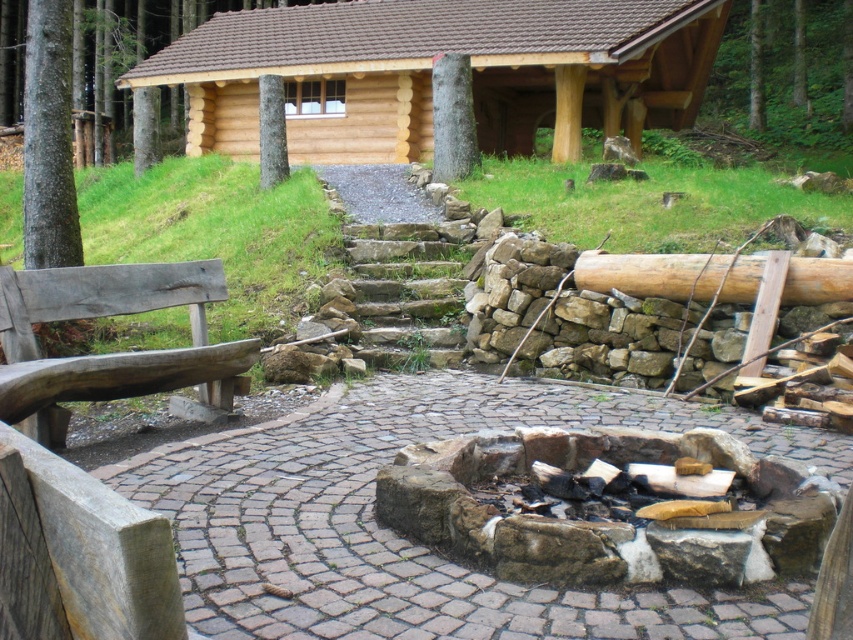
Question: Can you confirm if wooden cabin at upper center is positioned below wooden bench at left?

Choices:
 (A) no
 (B) yes

Answer: (A)

Question: Which point is closer to the camera?

Choices:
 (A) (44, 412)
 (B) (349, 3)

Answer: (A)

Question: Which point is farther to the camera?

Choices:
 (A) (329, 163)
 (B) (0, 416)

Answer: (A)

Question: Is wooden cabin at upper center to the right of wooden bench at left from the viewer's perspective?

Choices:
 (A) no
 (B) yes

Answer: (B)

Question: Is wooden cabin at upper center wider than wooden bench at left?

Choices:
 (A) yes
 (B) no

Answer: (A)